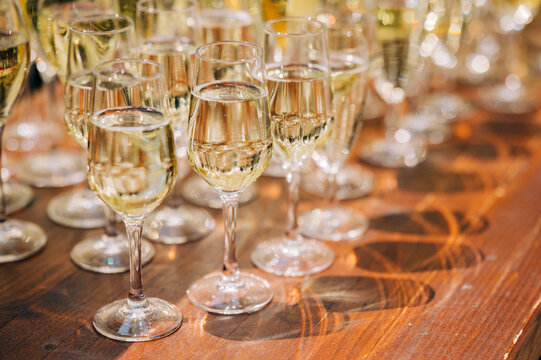
The image size is (541, 360). In order to click on wine glass rims in this screenshot , I will do `click(294, 34)`, `click(235, 60)`, `click(144, 79)`, `click(107, 34)`, `click(166, 11)`, `click(343, 29)`.